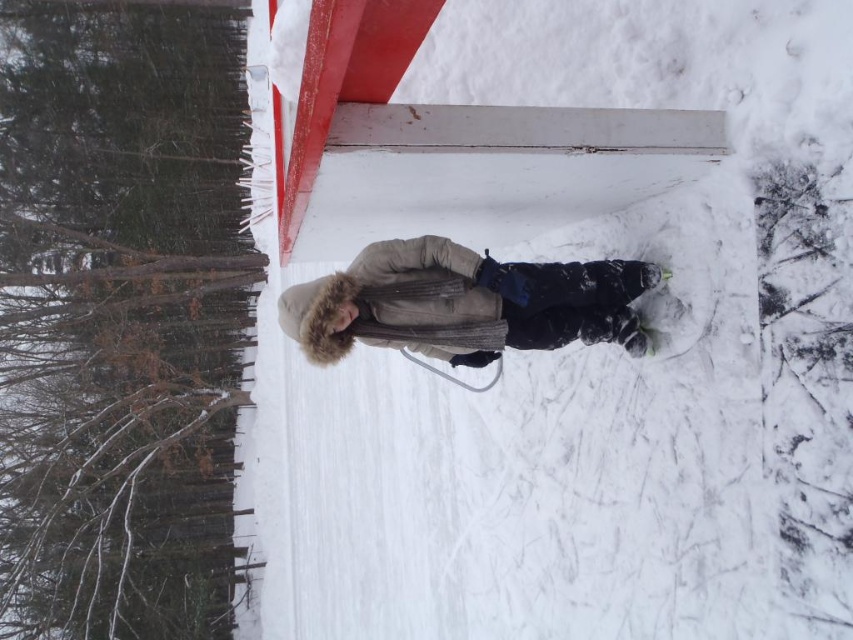
Question: Is white fluffy snow at center to the left of beige fur-lined coat at center from the viewer's perspective?

Choices:
 (A) yes
 (B) no

Answer: (A)

Question: Which point is farther to the camera?

Choices:
 (A) (x=653, y=112)
 (B) (x=463, y=333)

Answer: (B)

Question: Which object is closer to the camera taking this photo?

Choices:
 (A) white fluffy snow at center
 (B) beige fur-lined coat at center

Answer: (A)

Question: Is white fluffy snow at center wider than beige fur-lined coat at center?

Choices:
 (A) no
 (B) yes

Answer: (B)

Question: Does white fluffy snow at center have a lesser width compared to beige fur-lined coat at center?

Choices:
 (A) yes
 (B) no

Answer: (B)